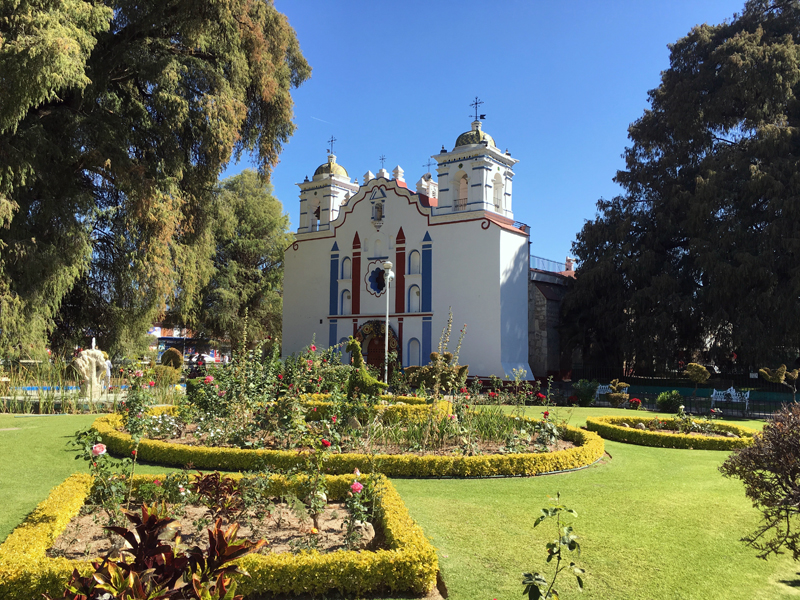
Locate an element on the screen. door is located at coordinates (380, 361).